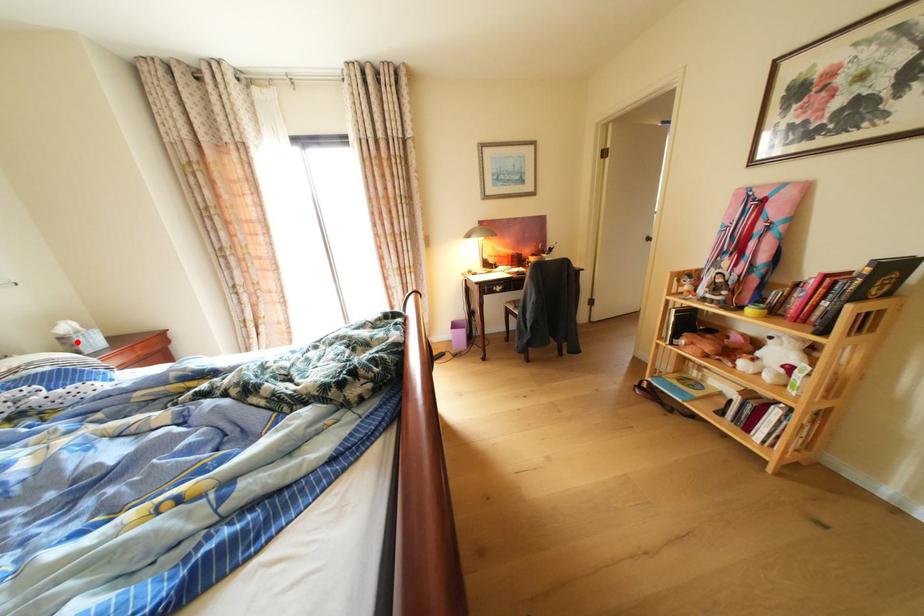
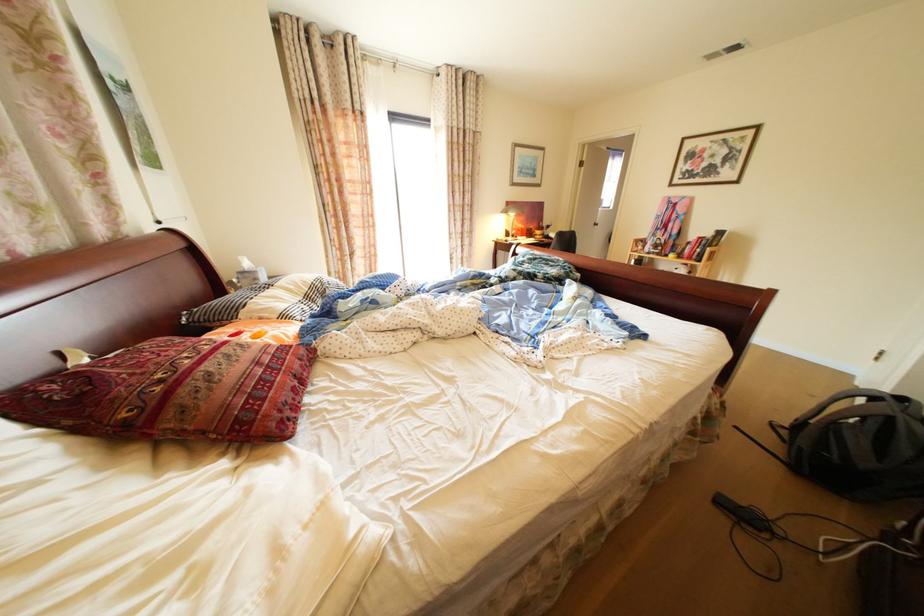
Question: I am providing you with two images of the same scene from different viewpoints. A red point is marked on the first image. At the location where the point appears in image 1, is it still visible in image 2?

Choices:
 (A) Yes
 (B) No

Answer: (A)